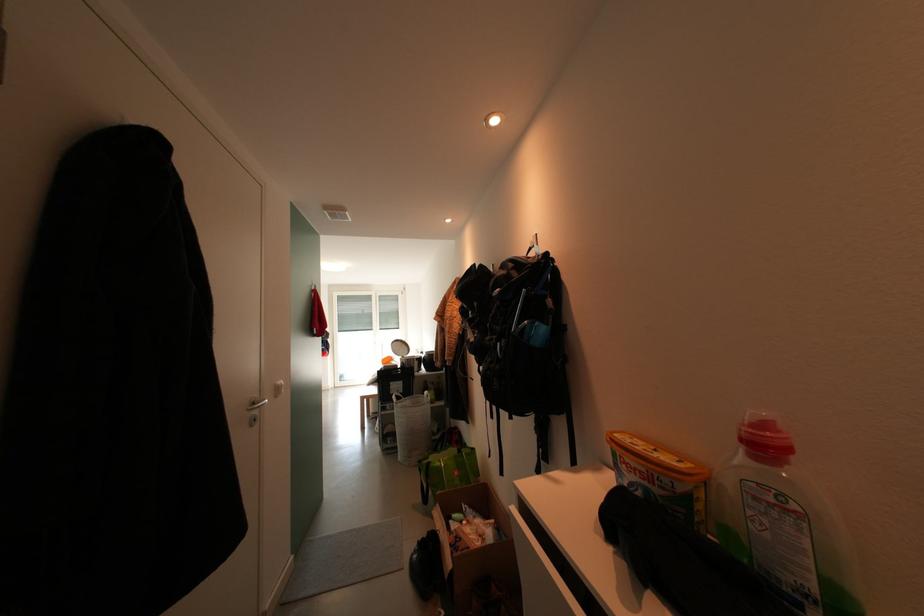
The image size is (924, 616). I want to click on red bottle cap, so click(x=789, y=476).